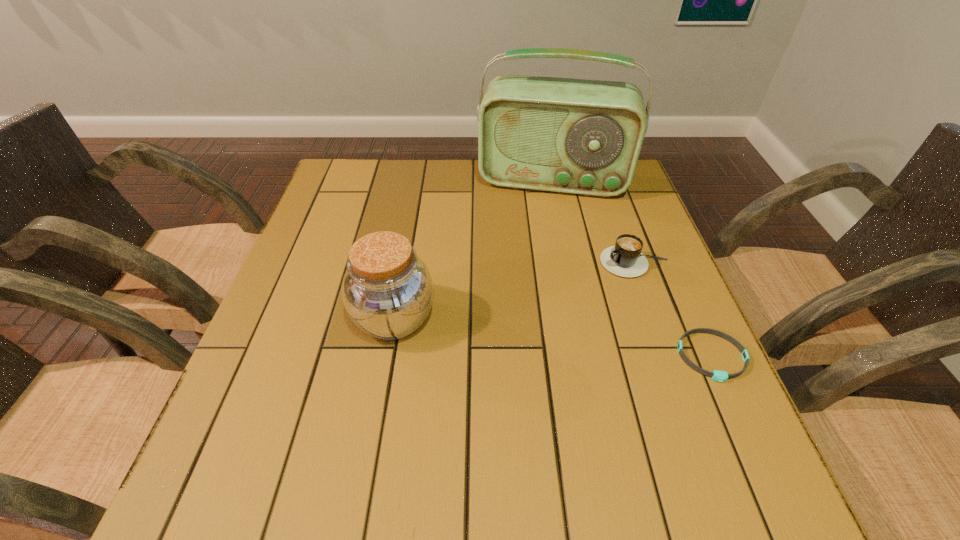
You are a GUI agent. You are given a task and a screenshot of the screen. Output one action in this format:
    pyautogui.click(x=<x>, y=<y>)
    Task: Click on the free space between the leftmost object and the radio receiver
    
    Given the screenshot: What is the action you would take?
    pyautogui.click(x=473, y=249)

Find the location of a particular element. vacant area between the second farthest object and the second tallest object is located at coordinates (515, 291).

Select which object is the closest to the wristband. Please provide its 2D coordinates. Your answer should be formatted as a tuple, i.e. [(x, y)], where the tuple contains the x and y coordinates of a point satisfying the conditions above.

[(625, 259)]

Select which object is the closest to the shortest object. Please provide its 2D coordinates. Your answer should be formatted as a tuple, i.e. [(x, y)], where the tuple contains the x and y coordinates of a point satisfying the conditions above.

[(625, 259)]

Identify the location of free point that satisfies the following two spatial constraints: 1. on the back side of the second tallest object; 2. on the left side of the second shortest object. The image size is (960, 540). (404, 263).

Identify the location of free point that satisfies the following two spatial constraints: 1. on the back side of the farthest object; 2. on the right side of the leftmost object. (419, 180).

Where is `free location that satisfies the following two spatial constraints: 1. on the back side of the jar; 2. on the left side of the farthest object`? This screenshot has height=540, width=960. free location that satisfies the following two spatial constraints: 1. on the back side of the jar; 2. on the left side of the farthest object is located at coordinates (419, 180).